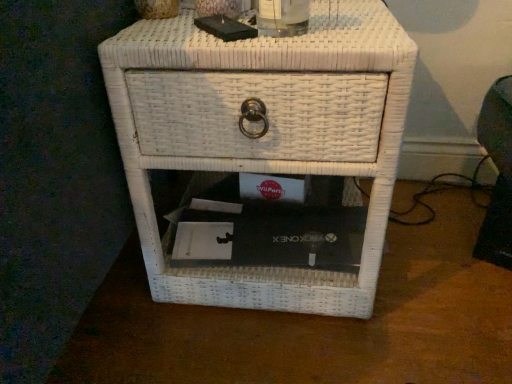
Question: Is white wicker nightstand at center to the left of clear glass bottle at upper center from the viewer's perspective?

Choices:
 (A) yes
 (B) no

Answer: (A)

Question: From a real-world perspective, is white wicker nightstand at center physically below clear glass bottle at upper center?

Choices:
 (A) yes
 (B) no

Answer: (A)

Question: From a real-world perspective, does white wicker nightstand at center stand above clear glass bottle at upper center?

Choices:
 (A) no
 (B) yes

Answer: (A)

Question: Considering the relative positions of white wicker nightstand at center and clear glass bottle at upper center in the image provided, is white wicker nightstand at center behind clear glass bottle at upper center?

Choices:
 (A) no
 (B) yes

Answer: (B)

Question: Could you tell me if white wicker nightstand at center is facing clear glass bottle at upper center?

Choices:
 (A) no
 (B) yes

Answer: (A)

Question: Is white wicker nightstand at center completely or partially outside of clear glass bottle at upper center?

Choices:
 (A) no
 (B) yes

Answer: (B)

Question: Is clear glass bottle at upper center with white wicker nightstand at center?

Choices:
 (A) no
 (B) yes

Answer: (A)

Question: From a real-world perspective, is clear glass bottle at upper center located higher than white wicker nightstand at center?

Choices:
 (A) yes
 (B) no

Answer: (A)

Question: From the image's perspective, does clear glass bottle at upper center appear lower than white wicker nightstand at center?

Choices:
 (A) yes
 (B) no

Answer: (B)

Question: Is the position of clear glass bottle at upper center less distant than that of white wicker nightstand at center?

Choices:
 (A) yes
 (B) no

Answer: (A)

Question: Is clear glass bottle at upper center surrounding white wicker nightstand at center?

Choices:
 (A) no
 (B) yes

Answer: (A)

Question: Can you confirm if clear glass bottle at upper center is taller than white wicker nightstand at center?

Choices:
 (A) no
 (B) yes

Answer: (A)

Question: Is white wicker nightstand at center in front of or behind clear glass bottle at upper center in the image?

Choices:
 (A) front
 (B) behind

Answer: (B)